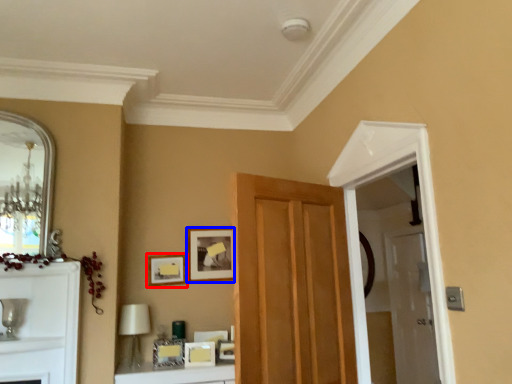
Question: Which object is closer to the camera taking this photo, picture frame (highlighted by a red box) or picture frame (highlighted by a blue box)?

Choices:
 (A) picture frame
 (B) picture frame

Answer: (A)